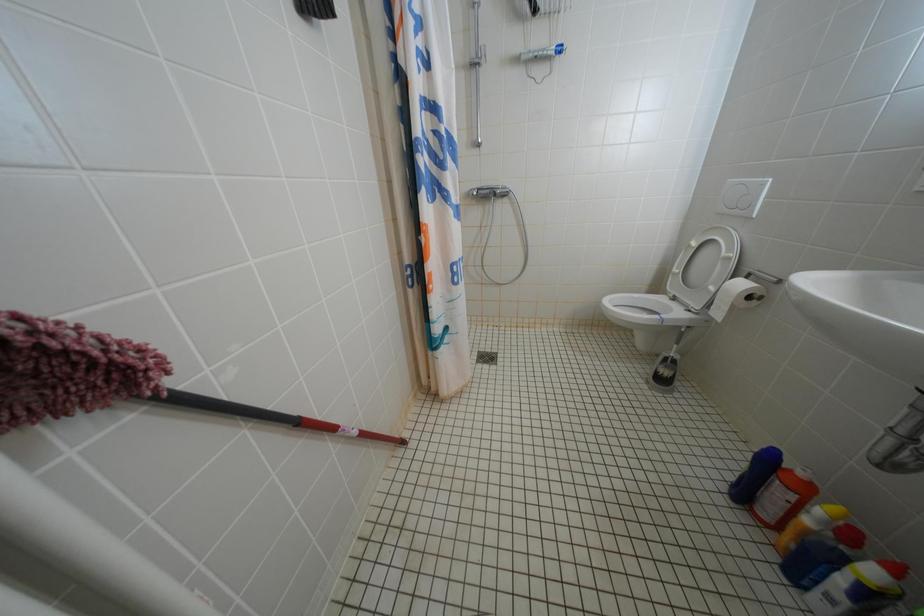
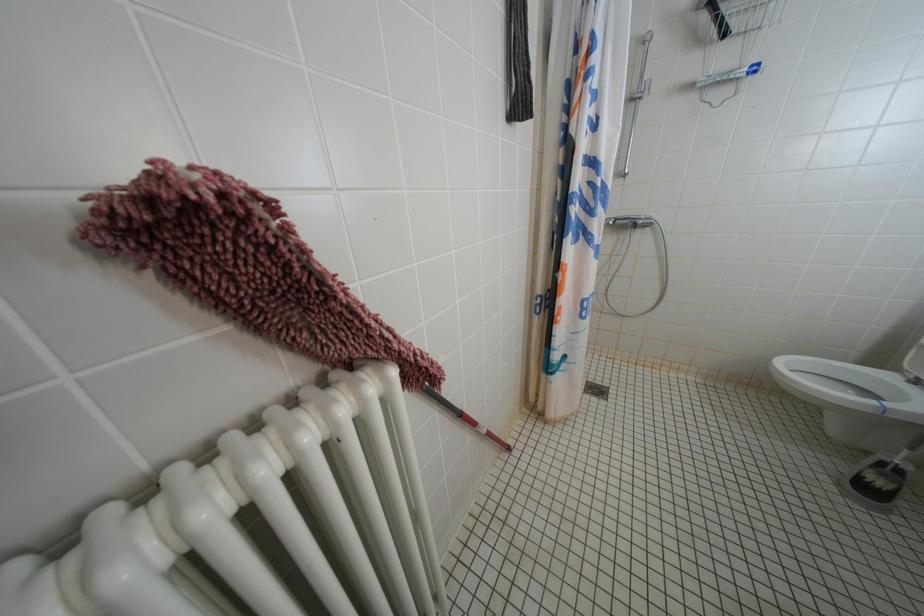
Which direction would the cameraman need to move to produce the second image?

The cameraman moved toward left, backward.